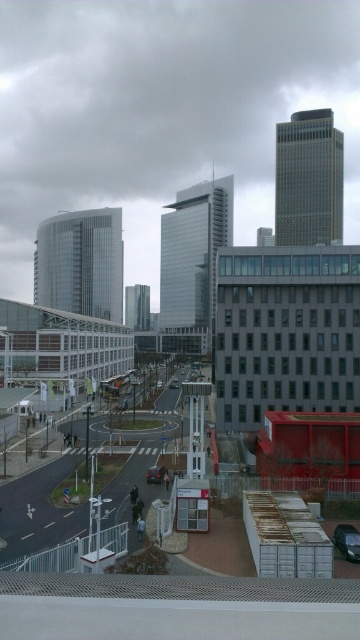
You are a pedestrian standing on the pathway in the foreground of the urban scene. You see a shiny black car at lower right and a shiny black car at center. Which car is positioned higher up in the image?

The shiny black car at lower right is positioned higher up in the image than the shiny black car at center because it is above it.

You are a delivery driver who needs to park your shiny black car at lower right in a parking spot that can only accommodate vehicles up to the width of the shiny black car at center. Can your car fit in the spot?

The shiny black car at lower right is narrower than the shiny black car at center, so it can fit in the parking spot designed for the width of the shiny black car at center.